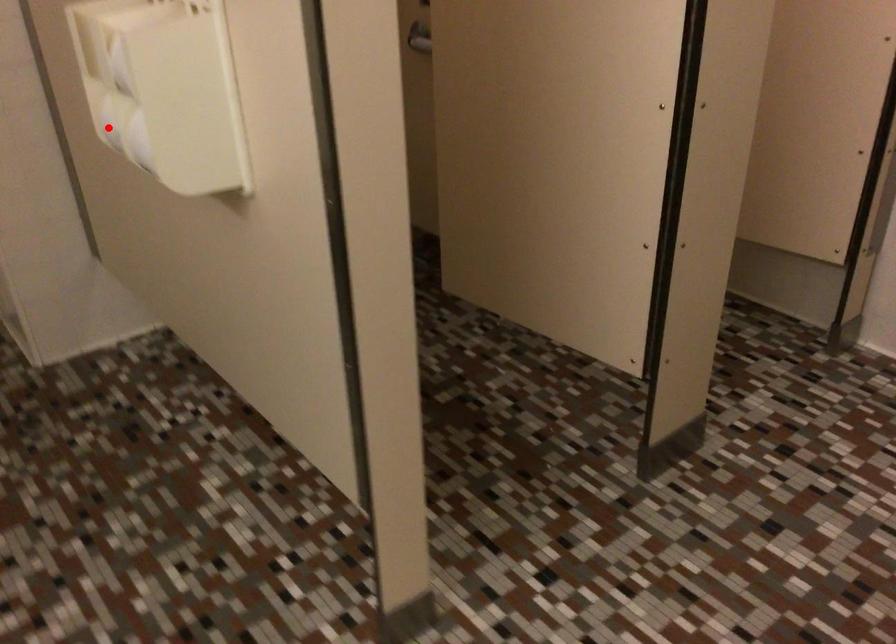
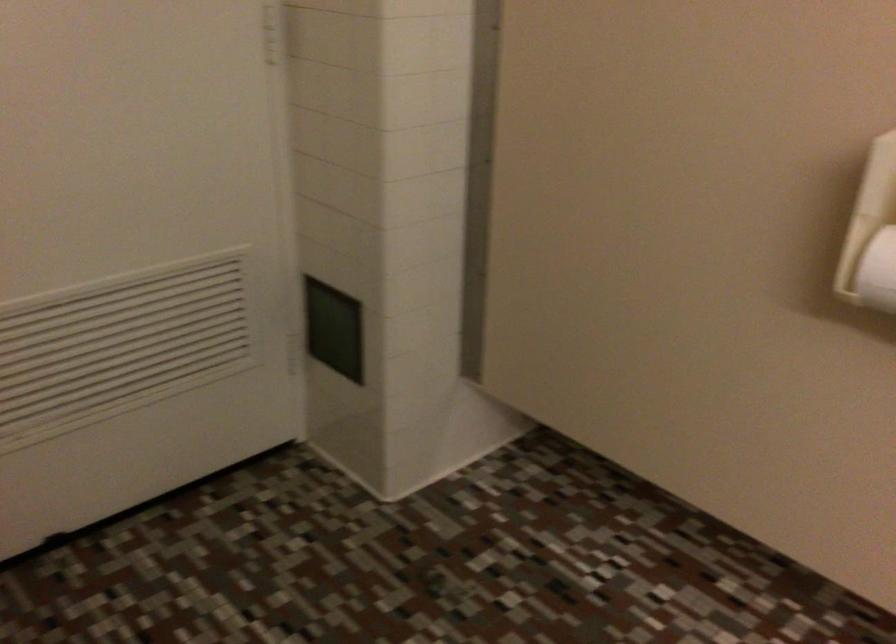
Question: I am providing you with two images of the same scene from different viewpoints. Given a red point in image1, look at the same physical point in image2. Is it:

Choices:
 (A) Closer to the viewpoint
 (B) Farther from the viewpoint

Answer: (A)